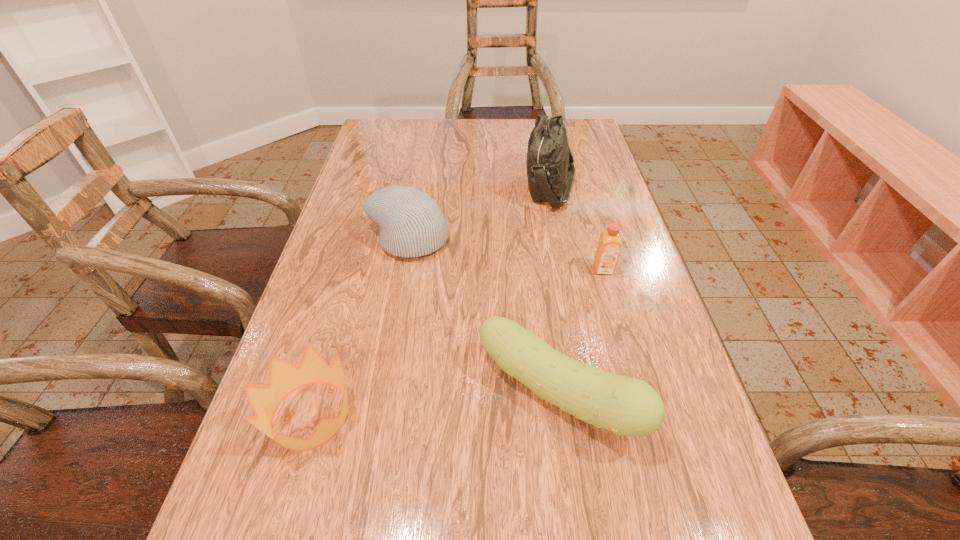
Locate an element on the screen. The height and width of the screenshot is (540, 960). vacant space at the right edge of the desktop is located at coordinates (638, 277).

Identify the location of free space at the far left corner. click(388, 133).

Find the location of a particular element. The image size is (960, 540). free region at the far right corner is located at coordinates (569, 139).

At what (x,y) coordinates should I click in order to perform the action: click on unoccupied position between the beanie and the shoulder bag. Please return your answer as a coordinate pair (x, y). Image resolution: width=960 pixels, height=540 pixels. Looking at the image, I should click on (479, 213).

Where is `free point between the cucumber and the orange juice`? The width and height of the screenshot is (960, 540). free point between the cucumber and the orange juice is located at coordinates (581, 332).

Identify the location of vacant space that is in between the crown and the cucumber. (435, 405).

I want to click on free space between the shortest object and the tallest object, so click(430, 301).

This screenshot has width=960, height=540. I want to click on vacant space in between the farthest object and the beanie, so click(x=479, y=213).

Find the location of a particular element. free space between the cucumber and the crown is located at coordinates (435, 405).

Image resolution: width=960 pixels, height=540 pixels. I want to click on free space between the orange juice and the shortest object, so click(x=457, y=342).